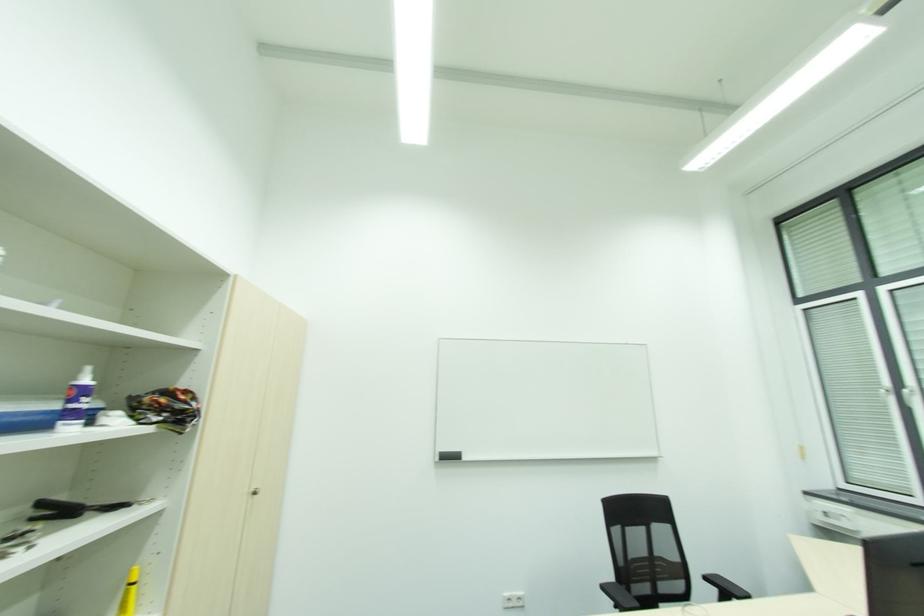
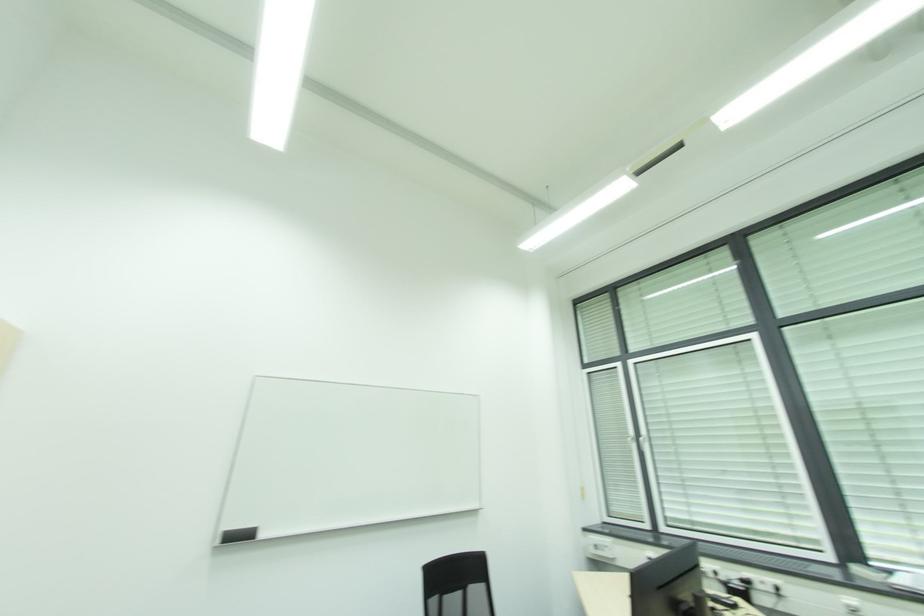
Question: The images are taken continuously from a first-person perspective. In which direction is your viewpoint rotating?

Choices:
 (A) Left
 (B) Right
 (C) Up
 (D) Down

Answer: (B)